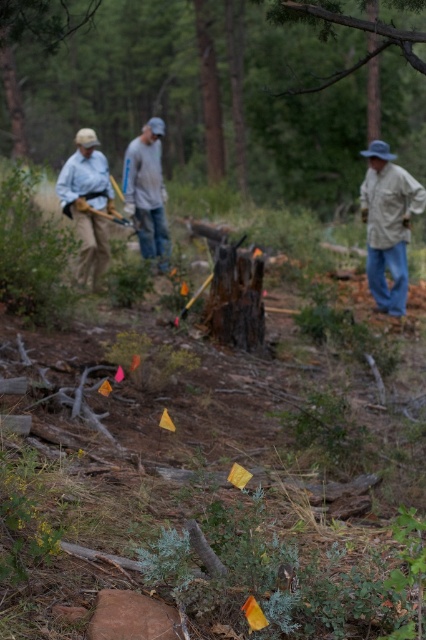
The image size is (426, 640). Identify the location of dark brown wood stump at center. (218, 86).

Does dark brown wood stump at center have a smaller size compared to light beige fabric shirt at right?

No.

This screenshot has height=640, width=426. I want to click on dark brown wood stump at center, so click(218, 86).

I want to click on dark brown wood stump at center, so coord(218,86).

Looking at this image, is light beige fabric shirt at right bigger than gray cotton shirt at center?

Yes, light beige fabric shirt at right is bigger than gray cotton shirt at center.

Which is behind, point (405, 310) or point (154, 116)?

Positioned behind is point (154, 116).

Between point (423, 193) and point (138, 170), which one is positioned behind?

Point (138, 170)

Identify the location of light beige fabric shirt at right. (388, 225).

Can you confirm if dark brown wood stump at center is wider than matte blue shirt at left?

Indeed, dark brown wood stump at center has a greater width compared to matte blue shirt at left.

Is point (299, 44) closer to viewer compared to point (65, 180)?

No.

Locate an element on the screen. dark brown wood stump at center is located at coordinates (218, 86).